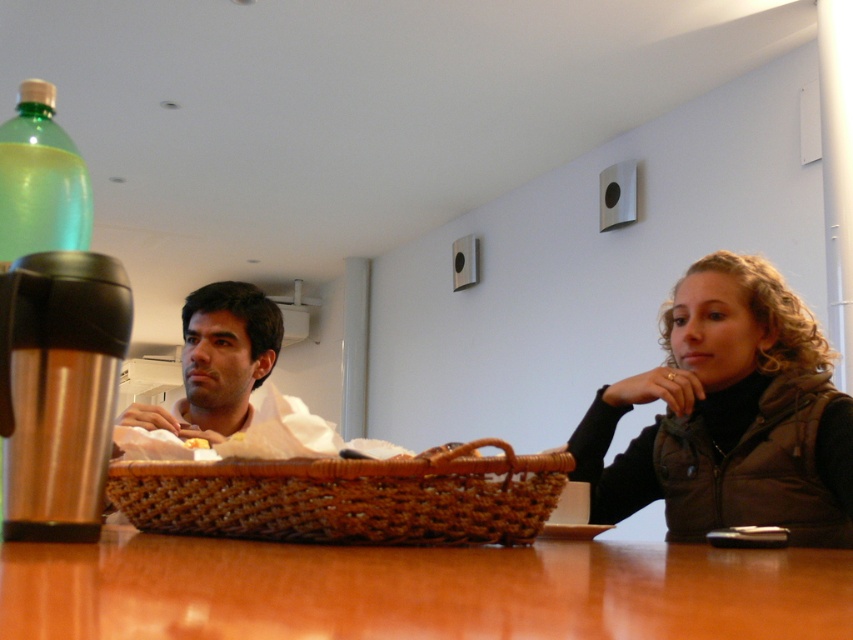
You are a photographer trying to capture a closeup of the yellow soft bread at center without the brown textured vest at right blocking the view. Can you position yourself in a way that the vest doesn t block your shot?

The brown textured vest at right is further to the viewer than the yellow soft bread at center, so if you move to the side opposite the vest, you can position yourself so the bread is between you and the vest, allowing you to take the closeup without obstruction.

Based on the photo, you are a fashion designer observing the image and want to note the position of the brown textured vest at right. Where exactly is it located in the image?

The brown textured vest at right is located at point 0.652 on the x axis and 0.856 on the y axis.

You are a server in a cafe and need to place a new order of coffee in a thermos that is 3 feet in diameter. The table has limited space. Can you fit the thermos between the brown textured vest at right and the brushed metal thermos at left without moving any other items?

The brown textured vest at right is 3.40 feet away from the brushed metal thermos at left. The new thermos is 3 feet in diameter, so there is enough space between them to place it without moving other items.